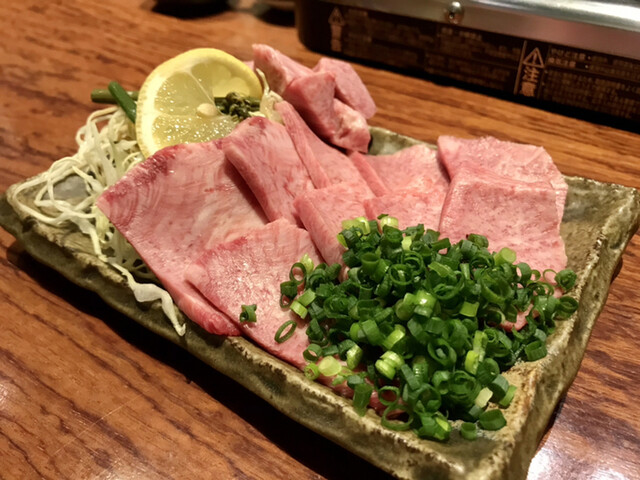
Where is `plate`? The width and height of the screenshot is (640, 480). plate is located at coordinates (604, 209).